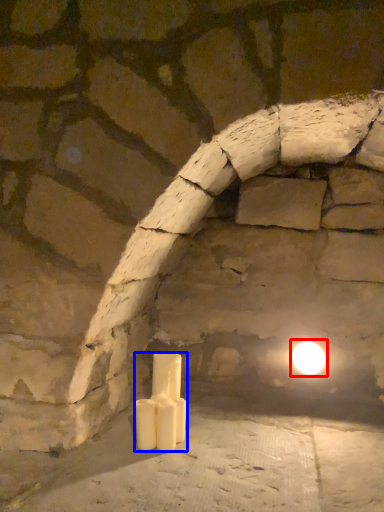
Question: Which of the following is the closest to the observer, moonlight (highlighted by a red box) or candle (highlighted by a blue box)?

Choices:
 (A) moonlight
 (B) candle

Answer: (B)